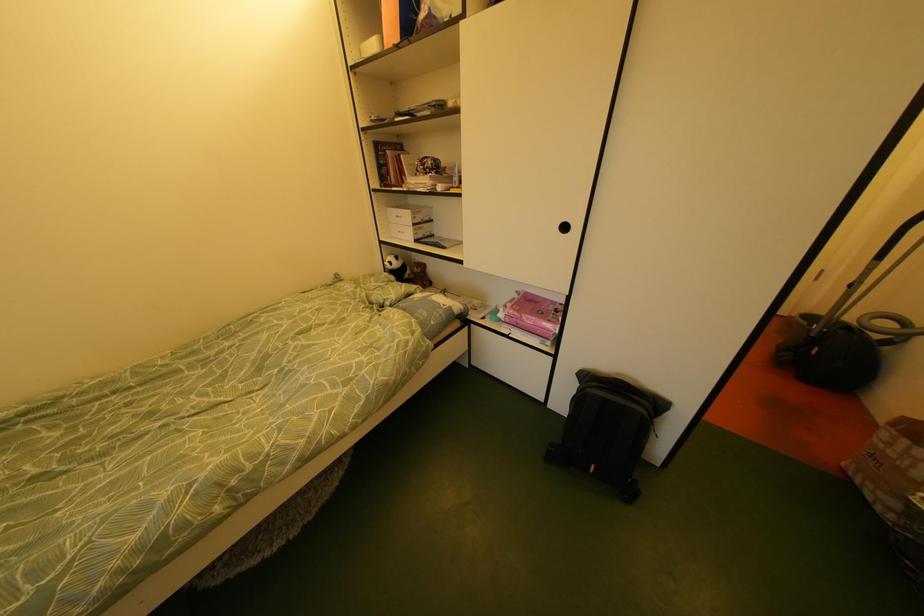
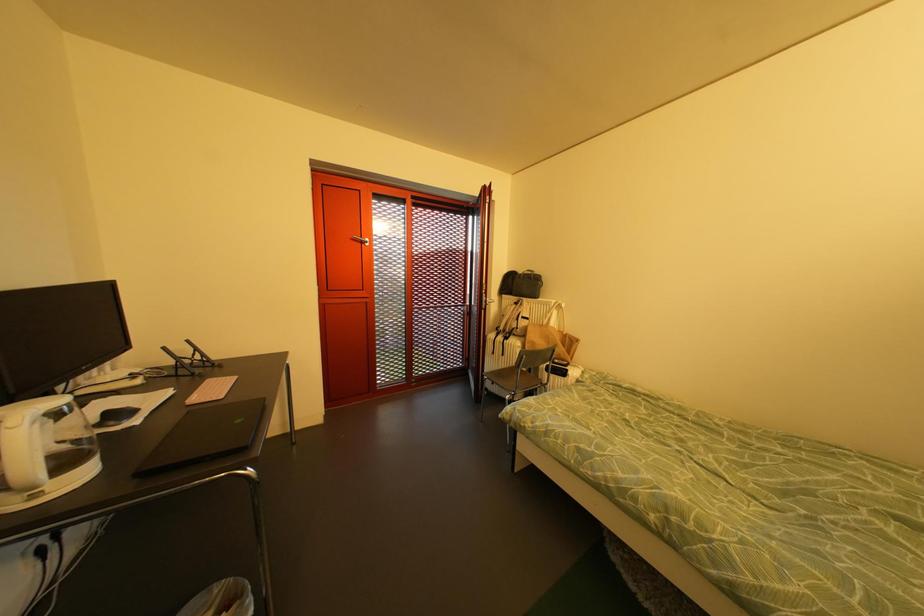
First-person continuous shooting, in which direction is the camera rotating?

The rotation direction of the camera is left-down.